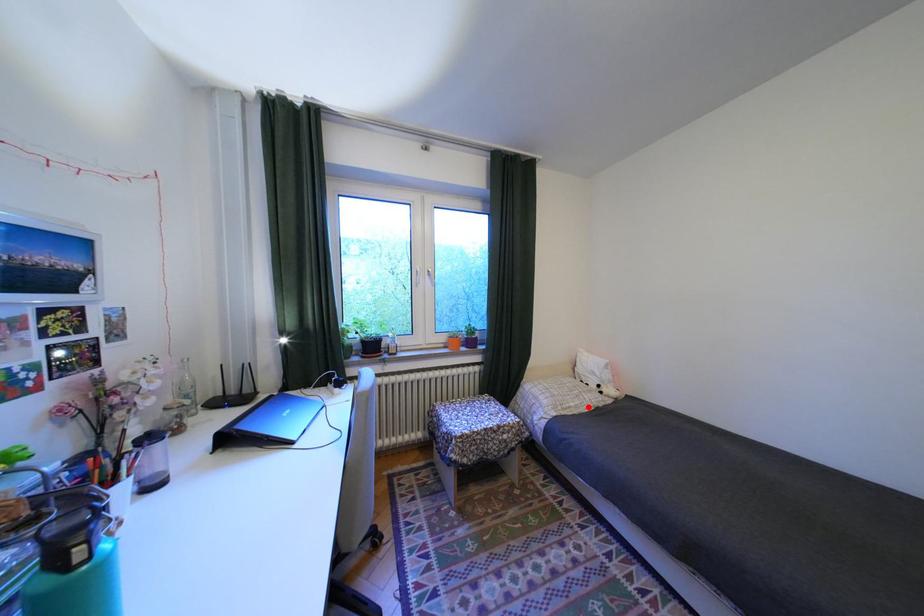
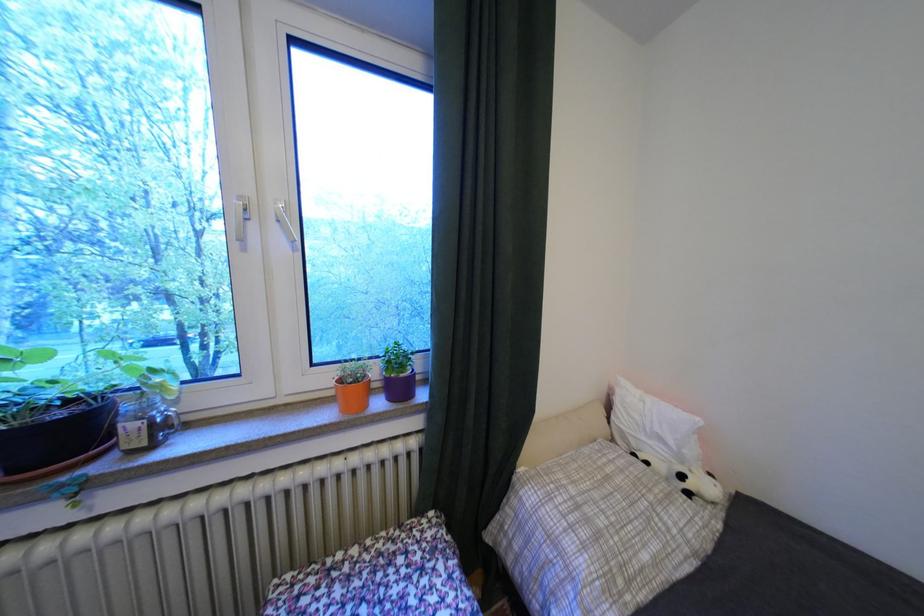
Question: I am providing you with two images of the same scene from different viewpoints. A red point is shown in image1. For the corresponding object point in image2, is it positioned nearer or farther from the camera?

Choices:
 (A) Nearer
 (B) Farther

Answer: (A)